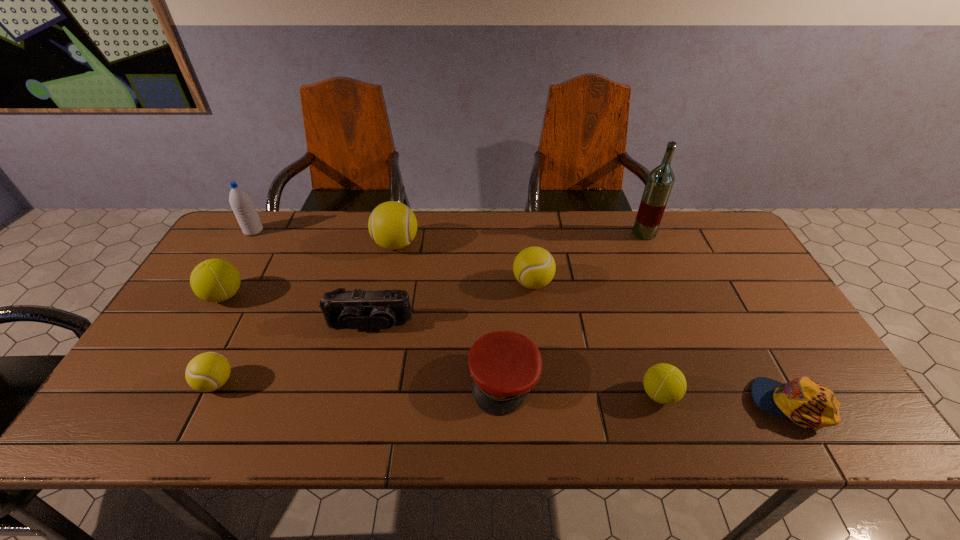
This screenshot has width=960, height=540. What are the coordinates of `tennis ball situated at the far edge` in the screenshot? It's located at (392, 225).

Image resolution: width=960 pixels, height=540 pixels. I want to click on tennis ball located in the near edge section of the desktop, so click(x=664, y=383).

This screenshot has height=540, width=960. Find the location of `water bottle that is at the left edge`. water bottle that is at the left edge is located at coordinates (241, 203).

Identify the location of object present at the right edge. (803, 401).

You are a GUI agent. You are given a task and a screenshot of the screen. Output one action in this format:
    pyautogui.click(x=<x>, y=<y>)
    Task: Click on the object that is at the far left corner
    
    Given the screenshot: What is the action you would take?
    pyautogui.click(x=241, y=203)

You are a GUI agent. You are given a task and a screenshot of the screen. Output one action in this format:
    pyautogui.click(x=<x>, y=<y>)
    Task: Click on the object that is at the near right corner
    The width and height of the screenshot is (960, 540).
    Given the screenshot: What is the action you would take?
    pyautogui.click(x=803, y=401)

The height and width of the screenshot is (540, 960). In order to click on free location at the far edge in this screenshot , I will do `click(416, 245)`.

This screenshot has height=540, width=960. In order to click on free space at the near edge of the desktop in this screenshot , I will do `click(216, 416)`.

The image size is (960, 540). In the image, there is a desktop. Identify the location of vacant area at the left edge. (161, 341).

The width and height of the screenshot is (960, 540). Identify the location of vacant space at the right edge. (732, 271).